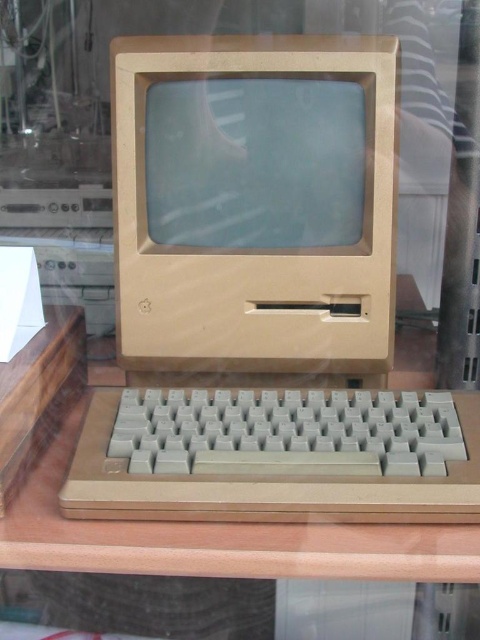
Question: Is beige plastic desktop computer at center to the right of gray plastic keyboard at bottom from the viewer's perspective?

Choices:
 (A) no
 (B) yes

Answer: (A)

Question: Which of these objects is positioned farthest from the wooden table at center?

Choices:
 (A) gray plastic keyboard at bottom
 (B) beige plastic desktop computer at center

Answer: (B)

Question: From the image, what is the correct spatial relationship of beige plastic desktop computer at center in relation to gold metallic computer monitor at center?

Choices:
 (A) above
 (B) below

Answer: (B)

Question: In this image, where is beige plastic desktop computer at center located relative to wooden table at center?

Choices:
 (A) above
 (B) below

Answer: (A)

Question: Estimate the real-world distances between objects in this image. Which object is closer to the beige plastic desktop computer at center?

Choices:
 (A) gray plastic keyboard at bottom
 (B) wooden table at center

Answer: (A)

Question: Which point is closer to the camera taking this photo?

Choices:
 (A) (216, 307)
 (B) (144, 65)
 (C) (163, 595)
 (D) (275, 433)

Answer: (D)